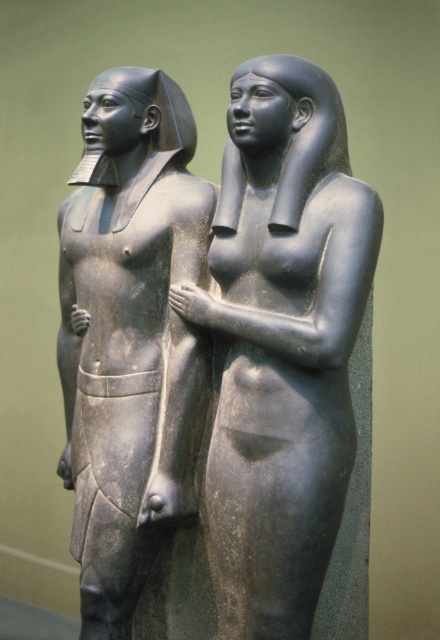
You are an archaeologist examining two matte black statues in a museum. The statues are labeled as the matte black statue at center and the matte black statue at left. Based on their placement and the description provided, which statue is wider?

The matte black statue at center is wider than the matte black statue at left according to the description provided.

You are an archaeologist examining two matte black statues in a museum. The statues are labeled as the matte black statue at center and the matte black statue at left. Based on their positions, which statue would cast a longer shadow if the light source is coming from above?

The matte black statue at left would cast a longer shadow because it is positioned below the matte black statue at center, meaning it is closer to the ground and thus its shadow would extend further away from the light source.

You are an archaeologist examining two ancient Egyptian statues. You notice that both statues are labeled as matte black statue at center and matte black statue at left. Based on their sizes, which one would you estimate to be the more significant figure in the historical context?

The matte black statue at center is larger in size than the matte black statue at left, so it is likely the more significant figure in the historical context.